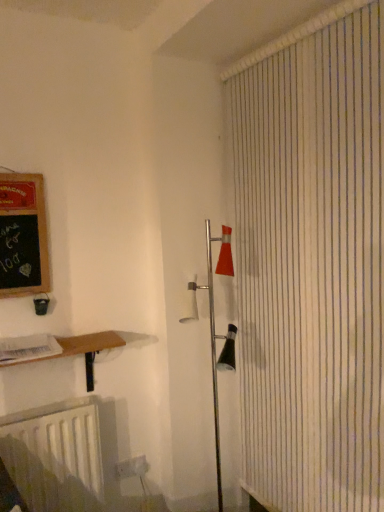
The height and width of the screenshot is (512, 384). What do you see at coordinates (23, 236) in the screenshot? I see `black chalkboard at left` at bounding box center [23, 236].

Locate an element on the screen. The width and height of the screenshot is (384, 512). white matte radiator at lower left is located at coordinates click(55, 456).

What is the approximate width of white matte radiator at lower left?

white matte radiator at lower left is 5.19 inches wide.

Image resolution: width=384 pixels, height=512 pixels. What do you see at coordinates (132, 467) in the screenshot?
I see `white plastic electric outlet at lower center` at bounding box center [132, 467].

Identify the location of black chalkboard at left. The height and width of the screenshot is (512, 384). (23, 236).

Visually, is white plastic electric outlet at lower center positioned to the left or to the right of wooden at lower left?

Clearly, white plastic electric outlet at lower center is on the right of wooden at lower left in the image.

Relative to wooden at lower left, is white plastic electric outlet at lower center in front or behind?

Clearly, white plastic electric outlet at lower center is behind wooden at lower left.

Based on the photo, considering the relative sizes of white plastic electric outlet at lower center and wooden at lower left in the image provided, is white plastic electric outlet at lower center taller than wooden at lower left?

Incorrect, the height of white plastic electric outlet at lower center is not larger of that of wooden at lower left.

Which is in front, white plastic electric outlet at lower center or white matte radiator at lower left?

Positioned in front is white matte radiator at lower left.

From the picture: Is white plastic electric outlet at lower center touching white matte radiator at lower left?

white plastic electric outlet at lower center and white matte radiator at lower left are clearly separated.

Is white plastic electric outlet at lower center at the right side of white matte radiator at lower left?

Yes, white plastic electric outlet at lower center is to the right of white matte radiator at lower left.

Could you tell me if white plastic electric outlet at lower center is turned towards white matte radiator at lower left?

No, white plastic electric outlet at lower center is not aimed at white matte radiator at lower left.

Can you confirm if wooden at lower left is bigger than white plastic electric outlet at lower center?

Correct, wooden at lower left is larger in size than white plastic electric outlet at lower center.

In the scene shown: From the image's perspective, relative to white plastic electric outlet at lower center, is wooden at lower left above or below?

From the image's perspective, wooden at lower left appears above white plastic electric outlet at lower center.

Would you say wooden at lower left contains white plastic electric outlet at lower center?

No, white plastic electric outlet at lower center is not surrounded by wooden at lower left.

Is wooden at lower left with white plastic electric outlet at lower center?

No, wooden at lower left is not touching white plastic electric outlet at lower center.

Considering their positions, is white matte radiator at lower left located in front of or behind white plastic electric outlet at lower center?

Clearly, white matte radiator at lower left is in front of white plastic electric outlet at lower center.

Would you say white matte radiator at lower left is to the left or to the right of white plastic electric outlet at lower center in the picture?

Clearly, white matte radiator at lower left is on the left of white plastic electric outlet at lower center in the image.

Locate an element on the screen. The image size is (384, 512). radiator that is above the white plastic electric outlet at lower center (from a real-world perspective) is located at coordinates (55, 456).

Considering the positions of points (98, 467) and (131, 472), is point (98, 467) farther from camera compared to point (131, 472)?

No, (98, 467) is closer to viewer.

Is black chalkboard at left oriented towards white matte radiator at lower left?

No, black chalkboard at left is not facing towards white matte radiator at lower left.

From the picture: Is black chalkboard at left next to white matte radiator at lower left and touching it?

black chalkboard at left and white matte radiator at lower left are not in contact.

Which of these two, black chalkboard at left or white matte radiator at lower left, is bigger?

white matte radiator at lower left is bigger.

Between white striped shower curtain at right and white plastic electric outlet at lower center, which one appears on the left side from the viewer's perspective?

From the viewer's perspective, white plastic electric outlet at lower center appears more on the left side.

Find the location of a particular element. The width and height of the screenshot is (384, 512). electric outlet located behind the white striped shower curtain at right is located at coordinates (132, 467).

Does point (294, 192) come behind point (145, 461)?

No, (294, 192) is closer to viewer.

Measure the distance from white striped shower curtain at right to white plastic electric outlet at lower center.

white striped shower curtain at right and white plastic electric outlet at lower center are 1.20 meters apart.

Considering the relative sizes of wooden at lower left and white striped shower curtain at right in the image provided, is wooden at lower left thinner than white striped shower curtain at right?

Incorrect, the width of wooden at lower left is not less than that of white striped shower curtain at right.

Are wooden at lower left and white striped shower curtain at right located far from each other?

No.

Does wooden at lower left come in front of white striped shower curtain at right?

That is False.

I want to click on electric outlet located on the right of wooden at lower left, so click(x=132, y=467).

You are a GUI agent. You are given a task and a screenshot of the screen. Output one action in this format:
    pyautogui.click(x=<x>, y=<y>)
    Task: Click on the electric outlet that is below the white matte radiator at lower left (from the image's perspective)
    Image resolution: width=384 pixels, height=512 pixels.
    Given the screenshot: What is the action you would take?
    pyautogui.click(x=132, y=467)

Considering their positions, is white striped shower curtain at right positioned further to white plastic electric outlet at lower center than wooden at lower left?

white striped shower curtain at right.

From the image, which object appears to be nearer to white matte radiator at lower left, white plastic electric outlet at lower center or wooden at lower left?

Based on the image, wooden at lower left appears to be nearer to white matte radiator at lower left.

In the scene shown: Based on their spatial positions, is white striped shower curtain at right or white matte radiator at lower left closer to white plastic electric outlet at lower center?

Based on the image, white matte radiator at lower left appears to be nearer to white plastic electric outlet at lower center.

Based on their spatial positions, is white plastic electric outlet at lower center or wooden at lower left closer to black chalkboard at left?

wooden at lower left is closer to black chalkboard at left.

When comparing their distances from white plastic electric outlet at lower center, does wooden at lower left or black chalkboard at left seem further?

black chalkboard at left is positioned further to the anchor white plastic electric outlet at lower center.

Looking at the image, which one is located closer to wooden at lower left, white striped shower curtain at right or white matte radiator at lower left?

white matte radiator at lower left lies closer to wooden at lower left than the other object.

Which object lies further to the anchor point wooden at lower left, white matte radiator at lower left or white plastic electric outlet at lower center?

Among the two, white plastic electric outlet at lower center is located further to wooden at lower left.

Based on their spatial positions, is white striped shower curtain at right or white plastic electric outlet at lower center further from black chalkboard at left?

white plastic electric outlet at lower center is further to black chalkboard at left.

Locate an element on the screen. The image size is (384, 512). shelf between white matte radiator at lower left and white striped shower curtain at right in the horizontal direction is located at coordinates (86, 350).

This screenshot has height=512, width=384. In order to click on shelf that lies between black chalkboard at left and white plastic electric outlet at lower center from top to bottom in this screenshot , I will do coord(86,350).

Where is `shower curtain between black chalkboard at left and white plastic electric outlet at lower center in the vertical direction`? shower curtain between black chalkboard at left and white plastic electric outlet at lower center in the vertical direction is located at coordinates (312, 264).

Where is `radiator located between black chalkboard at left and white striped shower curtain at right in the left-right direction`? radiator located between black chalkboard at left and white striped shower curtain at right in the left-right direction is located at coordinates click(x=55, y=456).